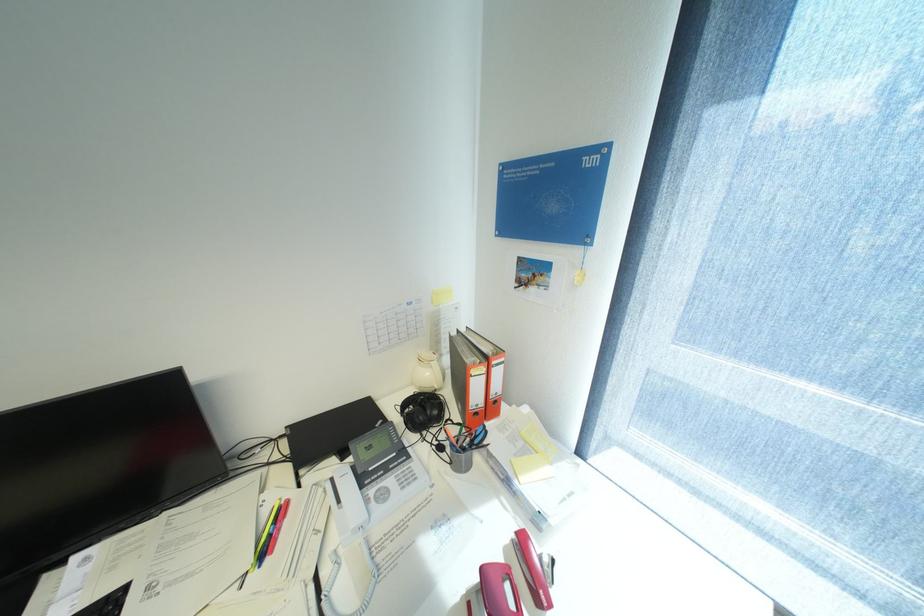
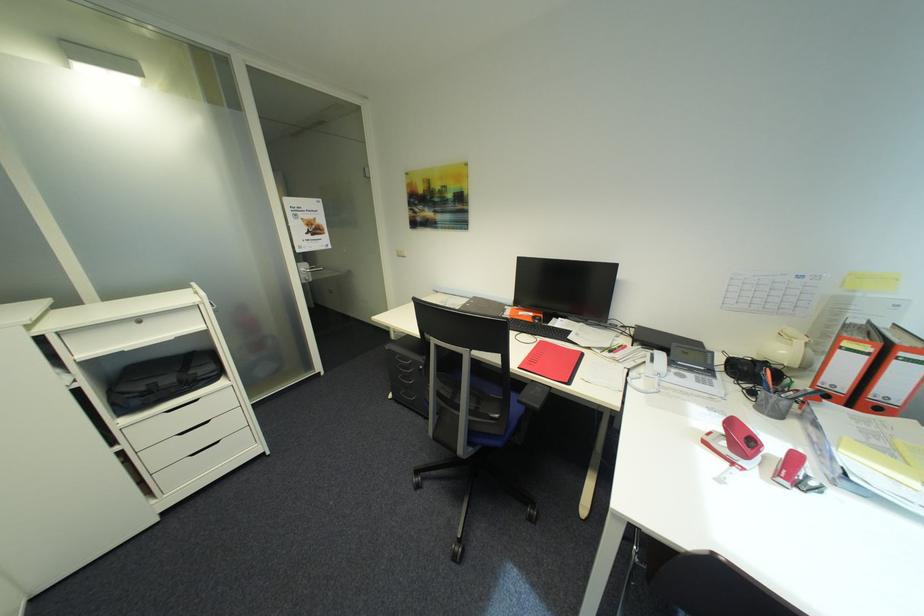
In the second image, find the point that corresponds to [492,378] in the first image.

(872, 359)